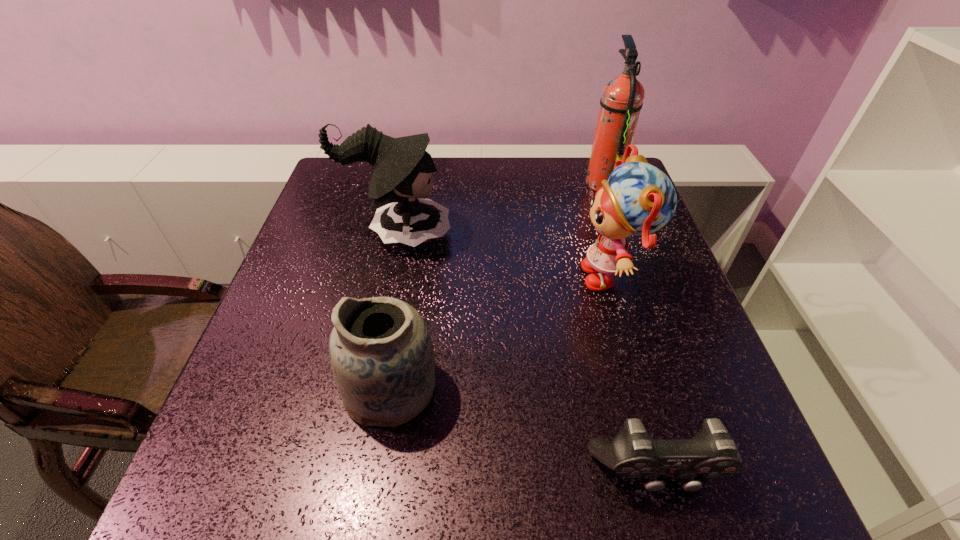
Locate an element on the screen. The height and width of the screenshot is (540, 960). vacant space located at the nozzle of the tallest object is located at coordinates (530, 182).

Locate an element on the screen. This screenshot has height=540, width=960. vacant space located at the face of the left doll is located at coordinates (550, 234).

Identify the location of free space located 0.320m on the face of the right doll. This screenshot has height=540, width=960. click(x=438, y=275).

At what (x,y) coordinates should I click in order to perform the action: click on vacant area situated on the face of the right doll. Please return your answer as a coordinate pair (x, y). Looking at the image, I should click on (539, 275).

In order to click on blank area located on the face of the right doll in this screenshot , I will do `click(425, 275)`.

The width and height of the screenshot is (960, 540). In order to click on vacant space located on the left of the pottery in this screenshot , I will do `click(235, 387)`.

The height and width of the screenshot is (540, 960). I want to click on object situated at the far edge, so click(622, 97).

You are a GUI agent. You are given a task and a screenshot of the screen. Output one action in this format:
    pyautogui.click(x=<x>, y=<y>)
    Task: Click on the object present at the near edge
    The height and width of the screenshot is (540, 960).
    Given the screenshot: What is the action you would take?
    pyautogui.click(x=711, y=453)

I want to click on object that is at the left edge, so click(x=401, y=172).

Identify the location of fire extinguisher positioned at the right edge. (622, 97).